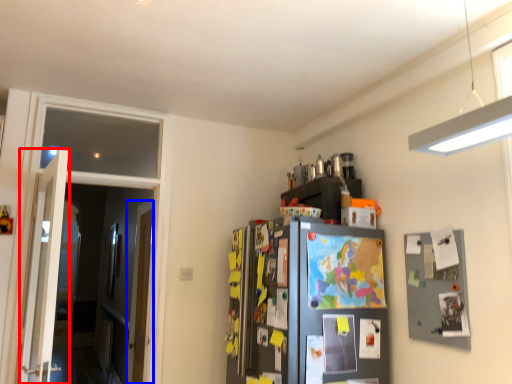
Question: Which point is closer to the camera, door (highlighted by a red box) or door (highlighted by a blue box)?

Choices:
 (A) door
 (B) door

Answer: (A)